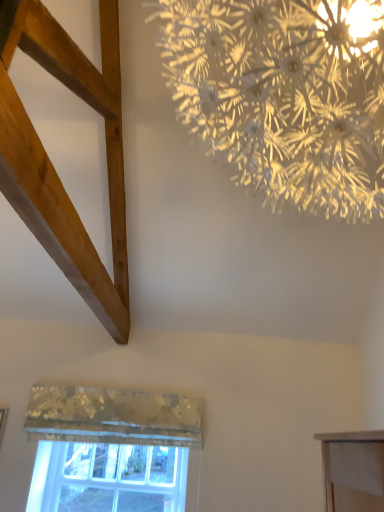
Question: From the image's perspective, is clear glass window at lower left positioned above or below natural wood plank at upper left?

Choices:
 (A) below
 (B) above

Answer: (A)

Question: Does point (112, 500) appear closer or farther from the camera than point (104, 321)?

Choices:
 (A) closer
 (B) farther

Answer: (B)

Question: Which object is positioned closest to the iridescent metallic chandelier at upper center?

Choices:
 (A) clear glass window at lower left
 (B) metallic textured curtain at lower center
 (C) natural wood plank at upper left

Answer: (C)

Question: Considering the real-world distances, which object is farthest from the clear glass window at lower left?

Choices:
 (A) iridescent metallic chandelier at upper center
 (B) metallic textured curtain at lower center
 (C) natural wood plank at upper left

Answer: (A)